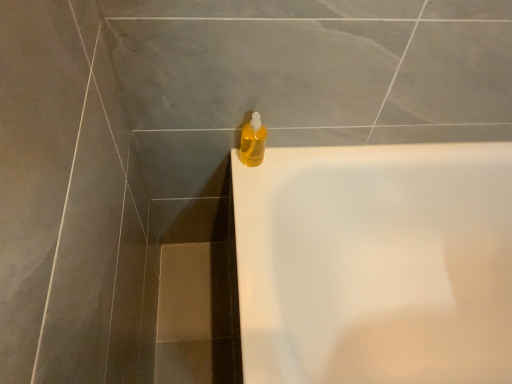
Question: Is white glossy bathtub at upper right in front of or behind translucent yellow liquid at upper right in the image?

Choices:
 (A) behind
 (B) front

Answer: (B)

Question: From a real-world perspective, is white glossy bathtub at upper right positioned above or below translucent yellow liquid at upper right?

Choices:
 (A) below
 (B) above

Answer: (A)

Question: Is white glossy bathtub at upper right inside the boundaries of translucent yellow liquid at upper right, or outside?

Choices:
 (A) outside
 (B) inside

Answer: (A)

Question: Is translucent yellow liquid at upper right to the left or to the right of white glossy bathtub at upper right in the image?

Choices:
 (A) left
 (B) right

Answer: (A)

Question: From a real-world perspective, is translucent yellow liquid at upper right above or below white glossy bathtub at upper right?

Choices:
 (A) above
 (B) below

Answer: (A)

Question: Is translucent yellow liquid at upper right wider or thinner than white glossy bathtub at upper right?

Choices:
 (A) thin
 (B) wide

Answer: (A)

Question: Considering their positions, is translucent yellow liquid at upper right located in front of or behind white glossy bathtub at upper right?

Choices:
 (A) behind
 (B) front

Answer: (A)